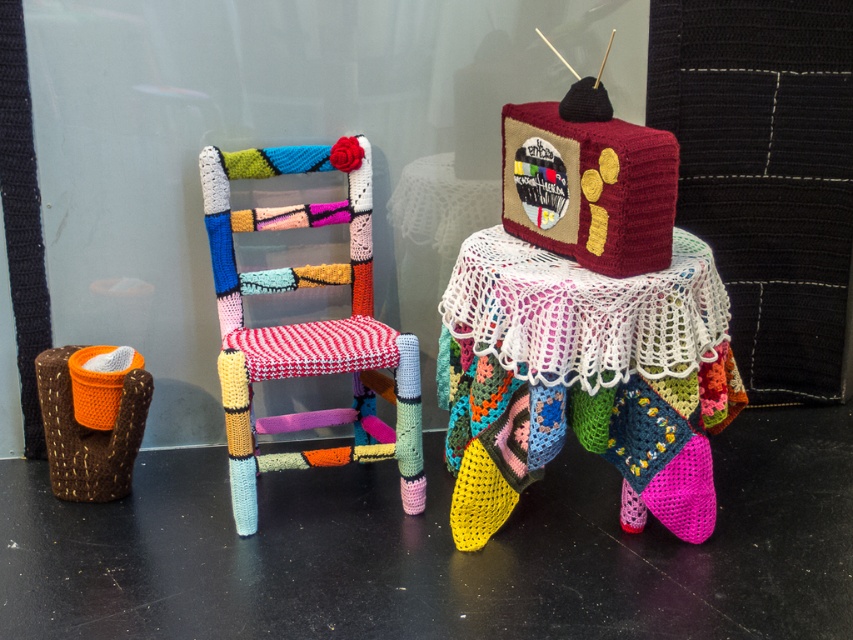
You are organizing a craft fair and need to decide which item to place first in the display. Given that the crochet fabric table at center and the crochet multicolored chair at center are both part of the setup, which item should you place first if you want to ensure there is enough space for both?

You should place the crochet fabric table at center first because it is larger in size than the crochet multicolored chair at center, ensuring there is enough space for both items.

Based on the scene description, where is the crochet multicolored chair at center located in terms of its 2D coordinates?

The crochet multicolored chair at center is located at the 2D coordinates of point (306, 324).

You are setting up a cozy living room and have both the crochet multicolored chair at center and the maroon knitted tv at center. Which item will require more floor space due to its size?

The crochet multicolored chair at center requires more floor space because it is larger in size than the maroon knitted tv at center.